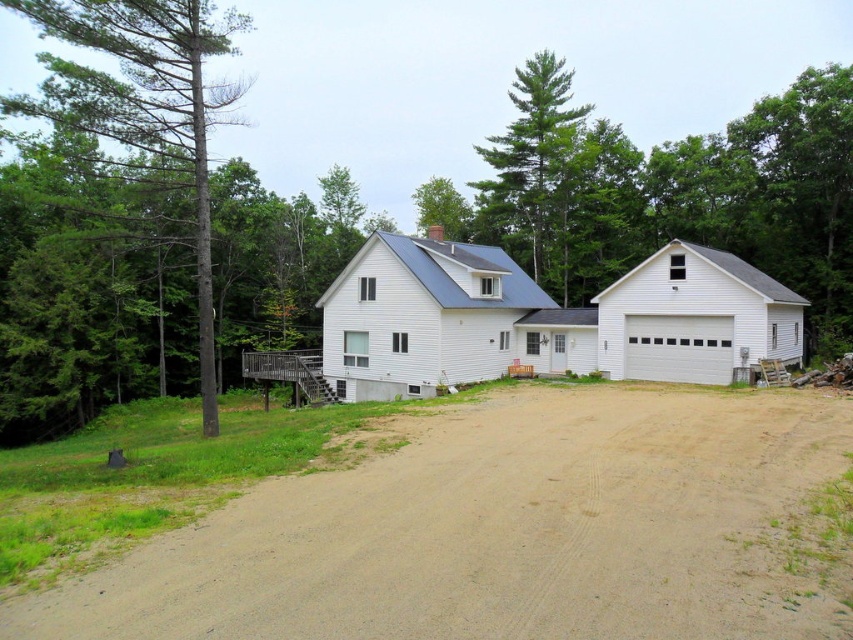
You are standing at the entrance of the house and looking towards the driveway. Which tree is closer to you, the green textured tree at left or the green leafy tree at upper center?

The green textured tree at left is closer to you because it is in front of the green leafy tree at upper center.

You are standing at the entrance of the house and want to walk to the detached garage. There are two points marked on the path. Which point should you step on first, point (378, 260) or point (421, 220)?

You should step on point (378, 260) first because it is in front of point (421, 220) along the path to the detached garage.